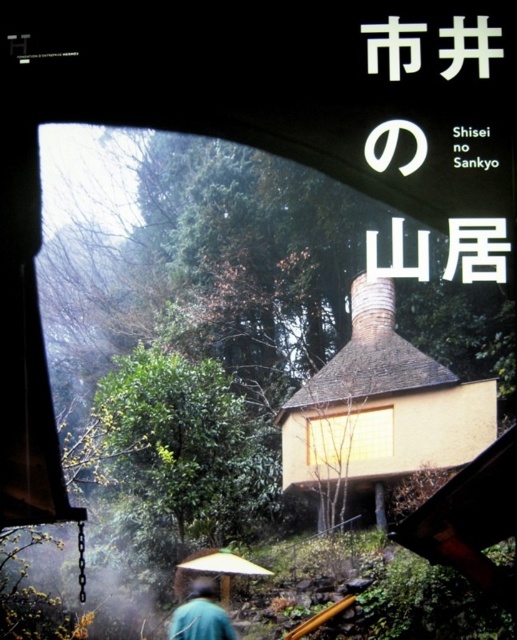
Question: Which point is closer to the camera?

Choices:
 (A) green matte jacket at lower center
 (B) yellow matte umbrella at lower center

Answer: (A)

Question: Considering the relative positions of green matte jacket at lower center and yellow matte umbrella at lower center in the image provided, where is green matte jacket at lower center located with respect to yellow matte umbrella at lower center?

Choices:
 (A) left
 (B) right

Answer: (A)

Question: Can you confirm if green matte jacket at lower center is positioned to the left of yellow matte umbrella at lower center?

Choices:
 (A) no
 (B) yes

Answer: (B)

Question: Which point appears closest to the camera in this image?

Choices:
 (A) (174, 612)
 (B) (212, 566)

Answer: (B)

Question: Does green matte jacket at lower center appear on the right side of yellow matte umbrella at lower center?

Choices:
 (A) yes
 (B) no

Answer: (B)